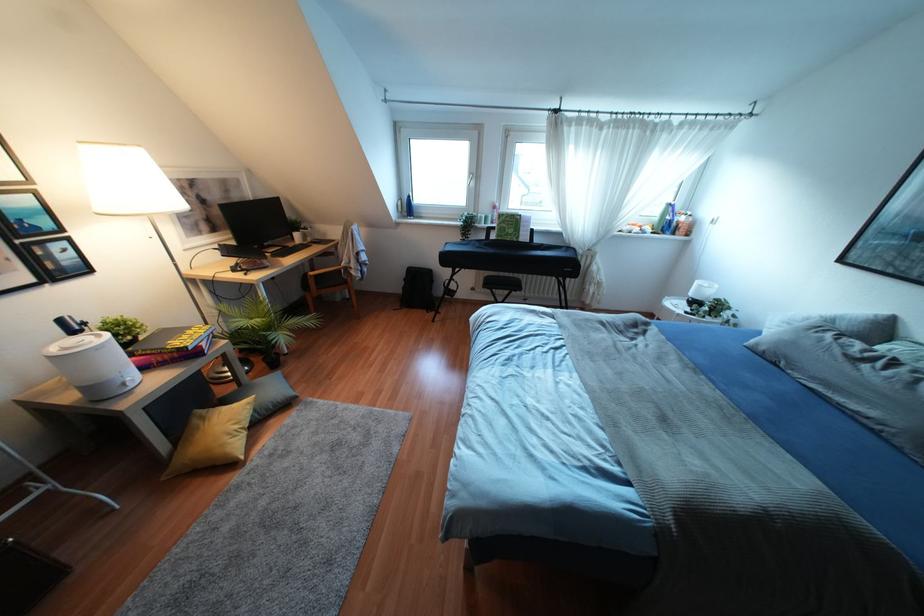
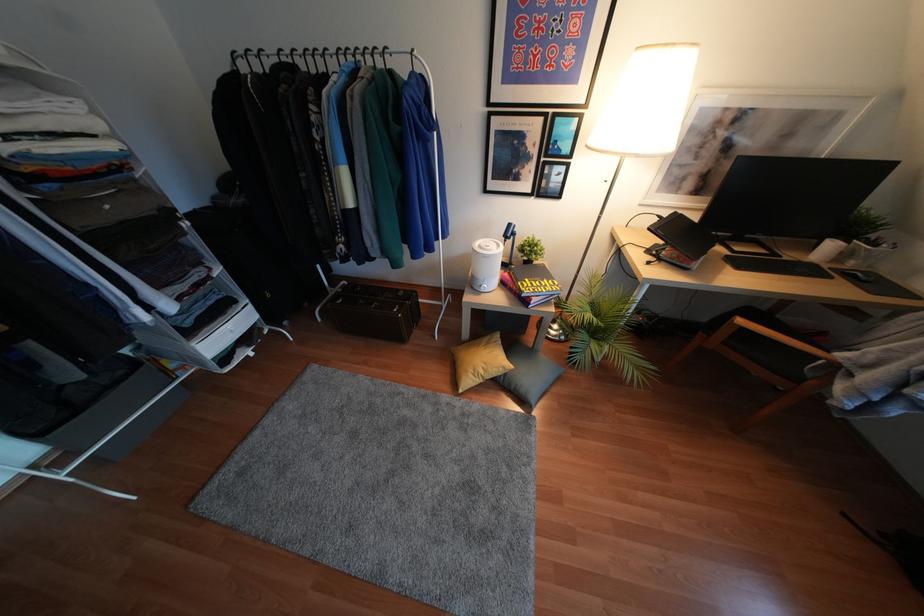
Locate, in the second image, the point that corresponds to (130,385) in the first image.

(481, 290)